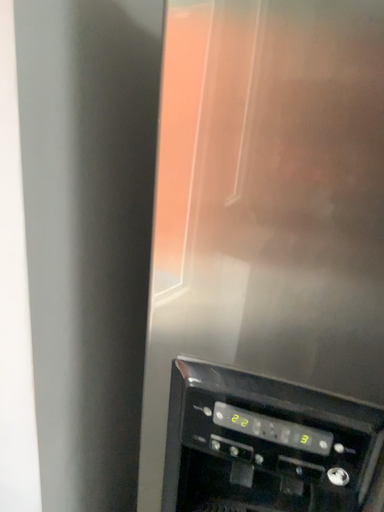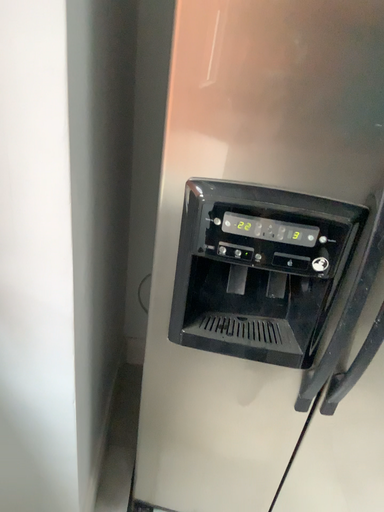
Question: How did the camera likely rotate when shooting the video?

Choices:
 (A) rotated downward
 (B) rotated upward

Answer: (A)